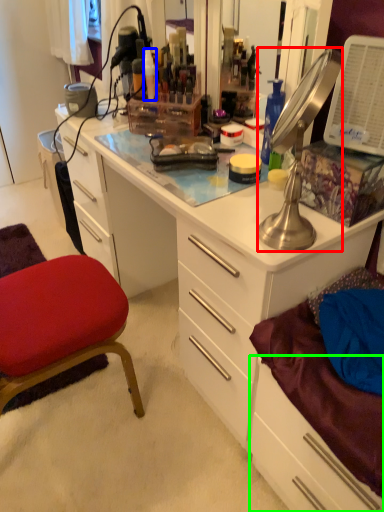
Question: Which is nearer to the lamp (highlighted by a red box)? toiletry (highlighted by a blue box) or drawer (highlighted by a green box).

Choices:
 (A) toiletry
 (B) drawer

Answer: (B)